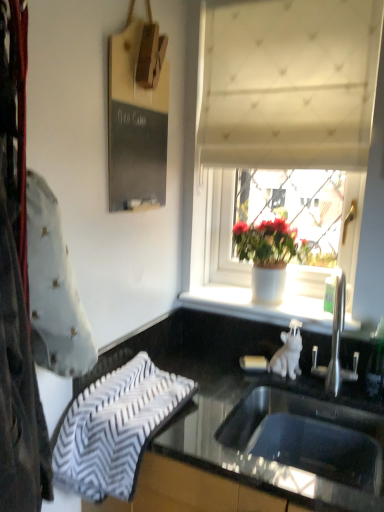
Where is `free spot above black glossy countertop at lower center (from a real-world perspective)`? free spot above black glossy countertop at lower center (from a real-world perspective) is located at coordinates (222, 384).